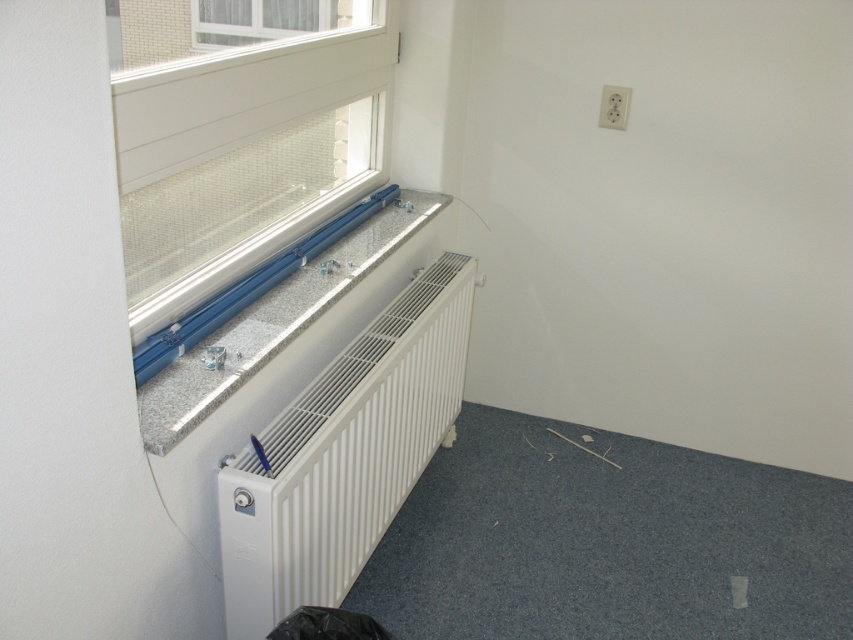
Question: Is white matte radiator at lower center to the left of granite/textured stone window sill at lower left from the viewer's perspective?

Choices:
 (A) yes
 (B) no

Answer: (B)

Question: Considering the real-world distances, which object is closest to the white matte radiator at lower center?

Choices:
 (A) granite/textured stone window sill at lower left
 (B) white textured window at upper left

Answer: (A)

Question: In this image, where is white matte radiator at lower center located relative to granite/textured stone window sill at lower left?

Choices:
 (A) above
 (B) below

Answer: (B)

Question: Which object is positioned closest to the white matte radiator at lower center?

Choices:
 (A) granite/textured stone window sill at lower left
 (B) white textured window at upper left

Answer: (A)

Question: Which of the following is the closest to the observer?

Choices:
 (A) granite/textured stone window sill at lower left
 (B) white textured window at upper left

Answer: (A)

Question: Does white matte radiator at lower center have a smaller size compared to granite/textured stone window sill at lower left?

Choices:
 (A) yes
 (B) no

Answer: (B)